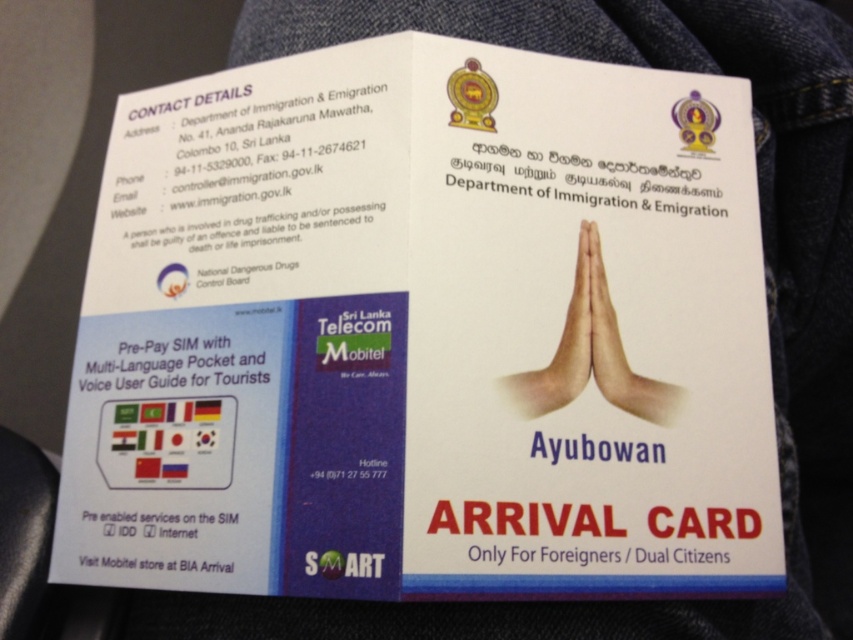
You are a traveler filling out an arrival card at an immigration counter. You notice a faded denim jacket at lower right and white matte hands at center. Which object is positioned lower in the scene?

The faded denim jacket at lower right is positioned below the white matte hands at center, so it is lower in the scene.

You are an immigration officer reviewing the ARRIVAL CARD. You notice a faded denim jacket at lower right and white matte hands at center. Which object is taller?

The faded denim jacket at lower right is taller than the white matte hands at center.

You are an immigration officer reviewing the ARRIVAL CARD. You notice a faded denim jacket at lower right and white matte hands at center. Which object is closer to you?

The faded denim jacket at lower right is closer to you because it is in front of the white matte hands at center.